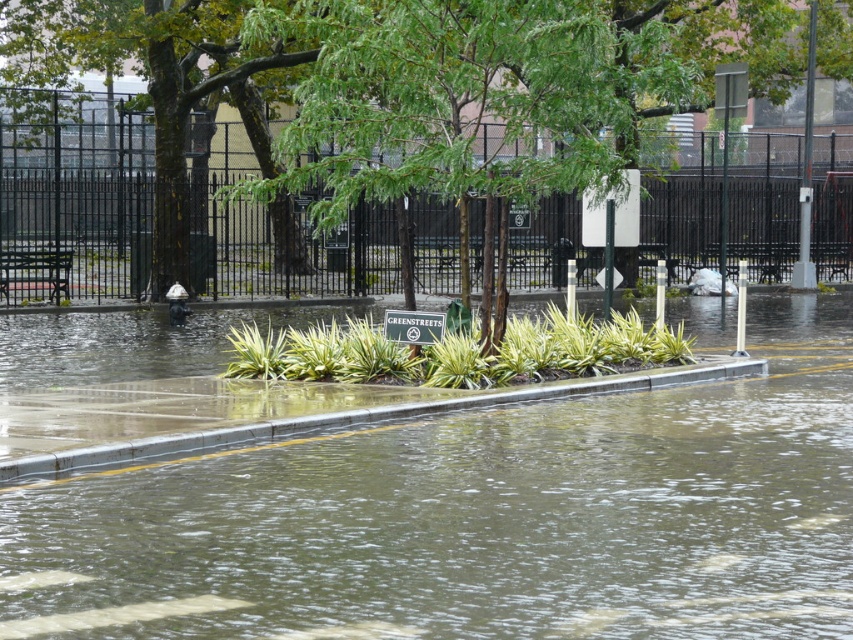
Based on the scene description, where is the green leafy tree at center located in terms of coordinates?

The green leafy tree at center is located at coordinates (x=398, y=88).

You are a pedestrian trying to cross the flooded street. The green leafy tree at center is in your path. Can you walk around it to reach the concrete at lower center?

The green leafy tree at center is 15.07 meters away from concrete at lower center. Since the tree is in your path, you can walk around it to reach the concrete at lower center as the distance allows for maneuvering around the tree.

You are a city planner analyzing the flooded area. The brown muddy water at center is represented by point [483,518]. What is the coordinate of the brown muddy water at center?

The brown muddy water at center is represented by point [483,518].